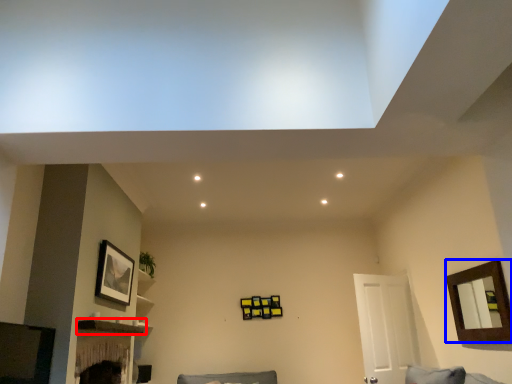
Question: Which object is closer to the camera taking this photo, shelf (highlighted by a red box) or picture frame (highlighted by a blue box)?

Choices:
 (A) shelf
 (B) picture frame

Answer: (B)